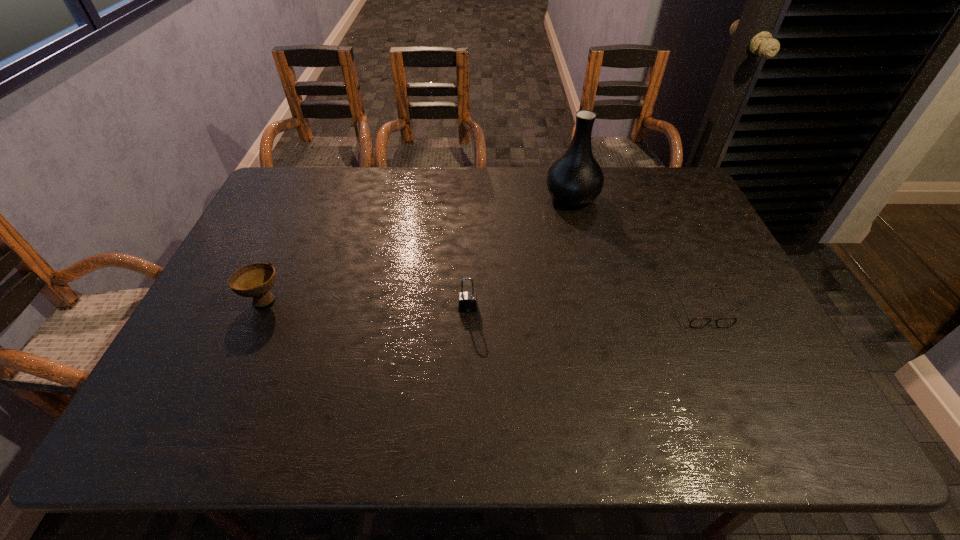
In order to click on the tallest object in this screenshot , I will do `click(575, 179)`.

Image resolution: width=960 pixels, height=540 pixels. Find the location of `the farthest object`. the farthest object is located at coordinates (575, 179).

Find the location of `the second object from left to right`. the second object from left to right is located at coordinates (468, 302).

Locate an element on the screen. This screenshot has width=960, height=540. the leftmost object is located at coordinates (255, 280).

This screenshot has height=540, width=960. What are the coordinates of `the third tallest object` in the screenshot? It's located at (255, 280).

This screenshot has height=540, width=960. What are the coordinates of `the rightmost object` in the screenshot? It's located at (695, 322).

At what (x,y) coordinates should I click in order to perform the action: click on the shortest object. Please return your answer as a coordinate pair (x, y). This screenshot has height=540, width=960. Looking at the image, I should click on (695, 322).

You are a GUI agent. You are given a task and a screenshot of the screen. Output one action in this format:
    pyautogui.click(x=<x>, y=<y>)
    Task: Click on the free spot located 0.170m on the left of the second object from right to left
    
    Given the screenshot: What is the action you would take?
    pyautogui.click(x=494, y=197)

At what (x,y) coordinates should I click in order to perform the action: click on free space located on the shackle of the second object from left to right. Please return your answer as a coordinate pair (x, y). The width and height of the screenshot is (960, 540). Looking at the image, I should click on [x=468, y=352].

Find the location of a particular element. vacant space located 0.260m on the back of the soup bowl is located at coordinates (298, 224).